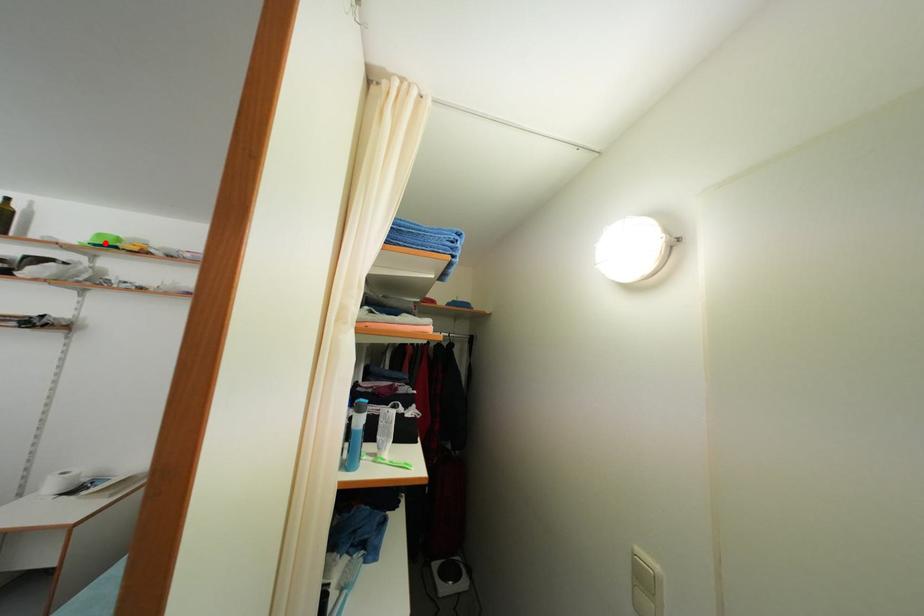
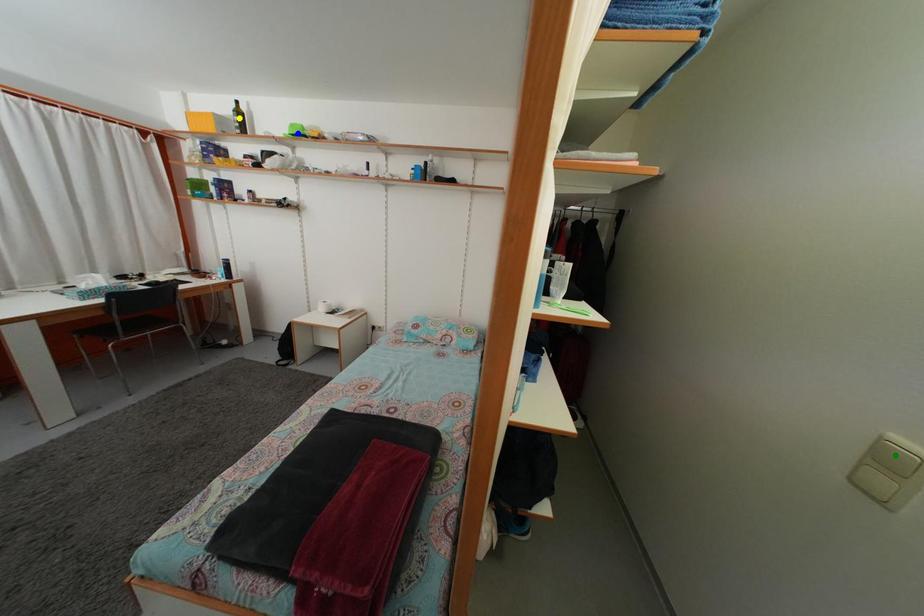
Question: I am providing you with two images of the same scene from different viewpoints. A red point is marked on the first image. You are given multiple points on the second image. Which point in image 2 is actually the same real-world point as the red point in image 1?

Choices:
 (A) green point
 (B) yellow point
 (C) blue point

Answer: (C)